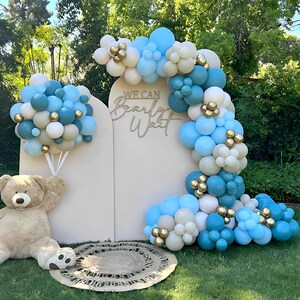
Where is `teddy bear's right arm`? The width and height of the screenshot is (300, 300). teddy bear's right arm is located at coordinates (54, 191).